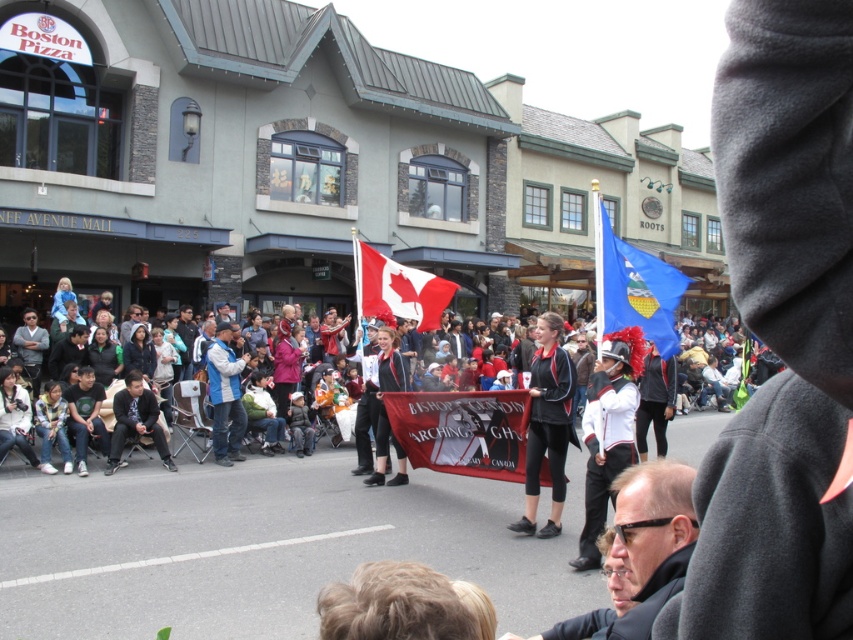
Is the position of matte black sunglasses at lower right more distant than that of matte black jacket at center?

No, matte black sunglasses at lower right is in front of matte black jacket at center.

Locate an element on the screen. The image size is (853, 640). matte black sunglasses at lower right is located at coordinates (650, 540).

Does matte black sunglasses at lower right appear over black leather jacket at center?

Yes, matte black sunglasses at lower right is above black leather jacket at center.

Is the position of matte black sunglasses at lower right less distant than that of black leather jacket at center?

Yes, it is.

Does point (628, 529) come closer to viewer compared to point (547, 339)?

Yes, point (628, 529) is closer to viewer.

At what (x,y) coordinates should I click in order to perform the action: click on matte black sunglasses at lower right. Please return your answer as a coordinate pair (x, y). Looking at the image, I should click on (650, 540).

Which is above, matte black sunglasses at lower right or blue denim jeans at center?

matte black sunglasses at lower right is higher up.

Find the location of a particular element. The image size is (853, 640). matte black sunglasses at lower right is located at coordinates (x=650, y=540).